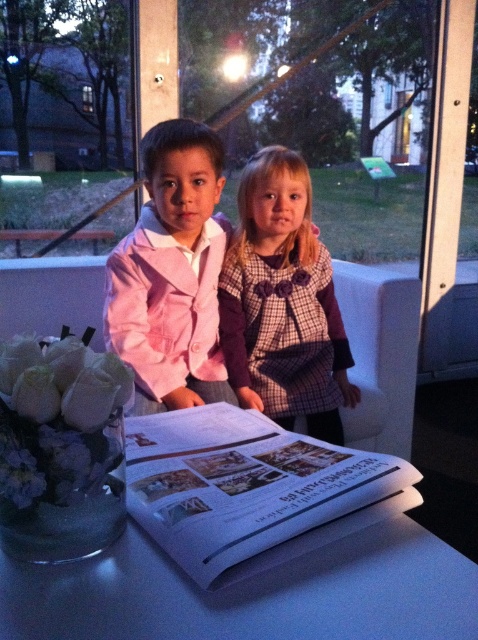
Who is positioned more to the left, white glossy table at center or plaid fabric dress at center?

white glossy table at center

The width and height of the screenshot is (478, 640). I want to click on white glossy table at center, so click(251, 595).

This screenshot has height=640, width=478. Describe the element at coordinates (251, 595) in the screenshot. I see `white glossy table at center` at that location.

Identify the location of white glossy table at center. Image resolution: width=478 pixels, height=640 pixels. (251, 595).

Is point (260, 182) in front of point (175, 326)?

No.

Between point (261, 362) and point (160, 147), which one is positioned behind?

Positioned behind is point (261, 362).

Locate an element on the screen. Image resolution: width=478 pixels, height=640 pixels. plaid fabric dress at center is located at coordinates (282, 301).

Which is above, matte pink jacket at center or white fabric flowers at lower left?

matte pink jacket at center is above.

Which is more to the left, matte pink jacket at center or white fabric flowers at lower left?

From the viewer's perspective, white fabric flowers at lower left appears more on the left side.

I want to click on matte pink jacket at center, so click(172, 273).

Where is `matte pink jacket at center`? The height and width of the screenshot is (640, 478). matte pink jacket at center is located at coordinates (172, 273).